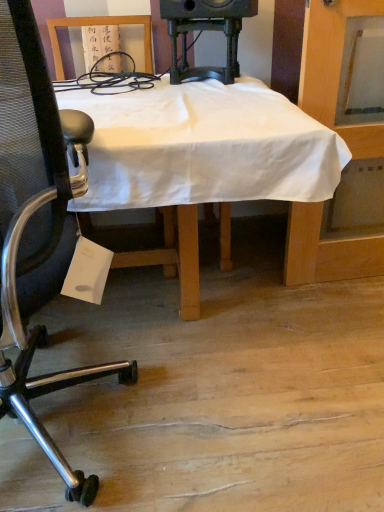
Question: Does metallic mesh chair at left have a lesser width compared to black plastic speaker at upper center?

Choices:
 (A) no
 (B) yes

Answer: (A)

Question: Is the depth of metallic mesh chair at left less than that of black plastic speaker at upper center?

Choices:
 (A) no
 (B) yes

Answer: (B)

Question: Does metallic mesh chair at left have a lesser height compared to black plastic speaker at upper center?

Choices:
 (A) yes
 (B) no

Answer: (B)

Question: From a real-world perspective, is metallic mesh chair at left physically above black plastic speaker at upper center?

Choices:
 (A) yes
 (B) no

Answer: (B)

Question: Does metallic mesh chair at left appear on the left side of black plastic speaker at upper center?

Choices:
 (A) yes
 (B) no

Answer: (A)

Question: From their relative heights in the image, would you say white cloth-covered desk at center is taller or shorter than metallic mesh chair at left?

Choices:
 (A) short
 (B) tall

Answer: (A)

Question: From the image's perspective, is white cloth-covered desk at center above or below metallic mesh chair at left?

Choices:
 (A) above
 (B) below

Answer: (A)

Question: Is white cloth-covered desk at center inside or outside of metallic mesh chair at left?

Choices:
 (A) inside
 (B) outside

Answer: (B)

Question: Is white cloth-covered desk at center wider or thinner than metallic mesh chair at left?

Choices:
 (A) thin
 (B) wide

Answer: (B)

Question: Considering the positions of metallic mesh chair at left and black plastic speaker at upper center in the image, is metallic mesh chair at left taller or shorter than black plastic speaker at upper center?

Choices:
 (A) short
 (B) tall

Answer: (B)

Question: From the image's perspective, relative to black plastic speaker at upper center, is metallic mesh chair at left above or below?

Choices:
 (A) below
 (B) above

Answer: (A)

Question: Is metallic mesh chair at left spatially inside black plastic speaker at upper center, or outside of it?

Choices:
 (A) inside
 (B) outside

Answer: (B)

Question: Is metallic mesh chair at left in front of or behind black plastic speaker at upper center in the image?

Choices:
 (A) front
 (B) behind

Answer: (A)

Question: From a real-world perspective, relative to white cloth-covered desk at center, is metallic mesh chair at left vertically above or below?

Choices:
 (A) above
 (B) below

Answer: (A)

Question: Does point (19, 119) appear closer or farther from the camera than point (127, 147)?

Choices:
 (A) farther
 (B) closer

Answer: (B)